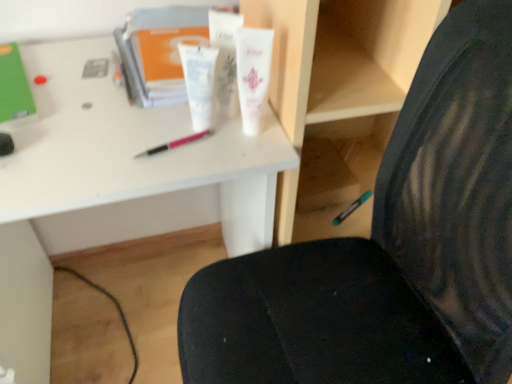
Where is `vacant area that is situated to the right of pink plastic pen at center`? vacant area that is situated to the right of pink plastic pen at center is located at coordinates (238, 143).